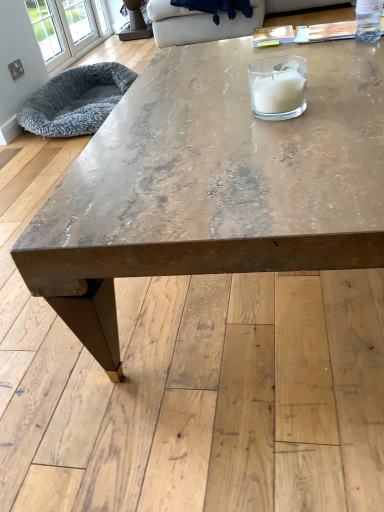
Question: Is white glass candle at upper center wider or thinner than distressed wood coffee table at center?

Choices:
 (A) wide
 (B) thin

Answer: (B)

Question: Considering their positions, is white glass candle at upper center located in front of or behind distressed wood coffee table at center?

Choices:
 (A) front
 (B) behind

Answer: (B)

Question: Based on their relative distances, which object is nearer to the white glass window at upper left?

Choices:
 (A) clear glass bottle at upper right
 (B) white glass candle at upper center
 (C) distressed wood coffee table at center
 (D) beige fabric couch at upper center
 (E) gray fluffy pet bed at left

Answer: (E)

Question: Which is farther from the gray fluffy pet bed at left?

Choices:
 (A) clear glass bottle at upper right
 (B) white glass window at upper left
 (C) distressed wood coffee table at center
 (D) beige fabric couch at upper center
 (E) white glass candle at upper center

Answer: (E)